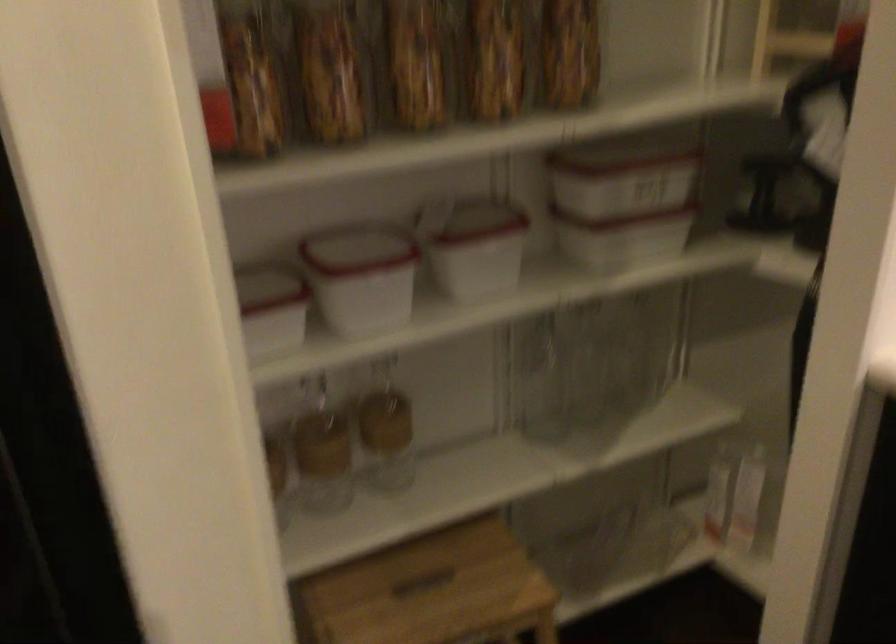
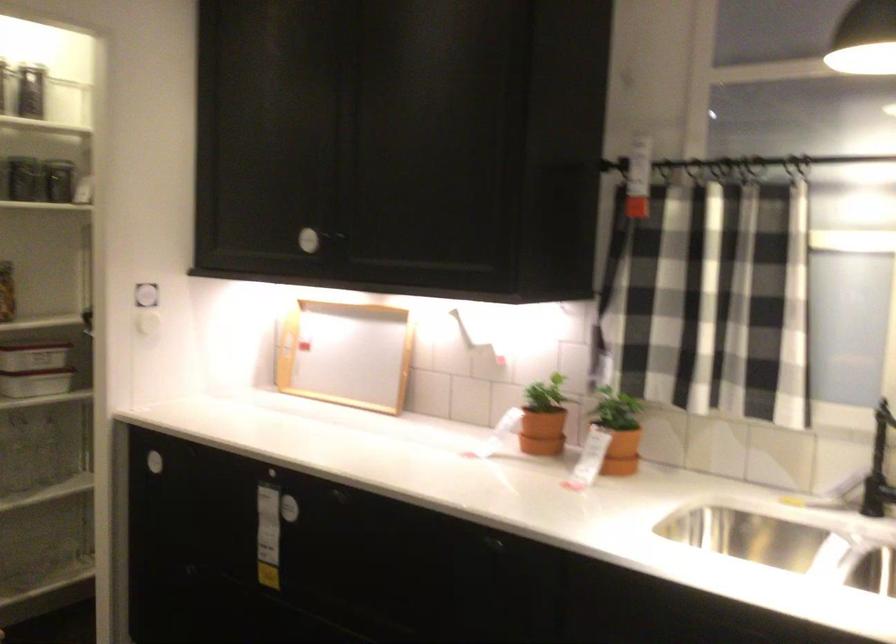
Where in the second image is the point corresponding to (x=634, y=219) from the first image?

(35, 368)